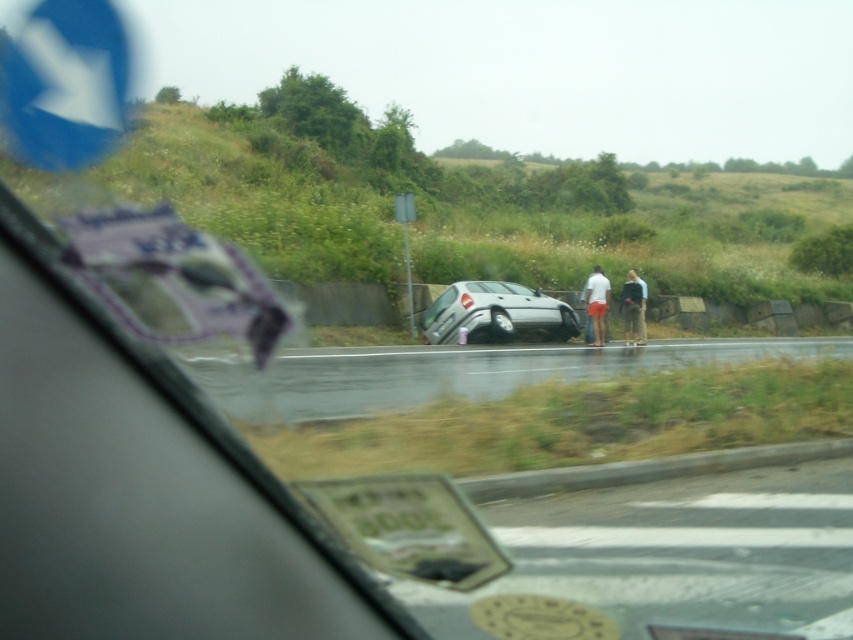
You are a passenger in the vehicle and notice two objects outside the window. The silver metallic car at center and the light blue jeans at center. Which object is closer to the left side of the window?

The silver metallic car at center is to the left of light blue jeans at center, so the silver metallic car at center is closer to the left side of the window.

You are a passenger in a car and you see the satin silver car at center and the light blue jeans at center in the scene. Which object is taller?

The light blue jeans at center are taller than the satin silver car at center.

You are driving a car and see the satin silver car at center from 82.63 feet away. Can you safely stop your car before hitting it if you are traveling at 30 mph?

The satin silver car at center is 82.63 feet away. At 30 mph, the stopping distance is approximately 73 feet, so you can safely stop before hitting the satin silver car at center.